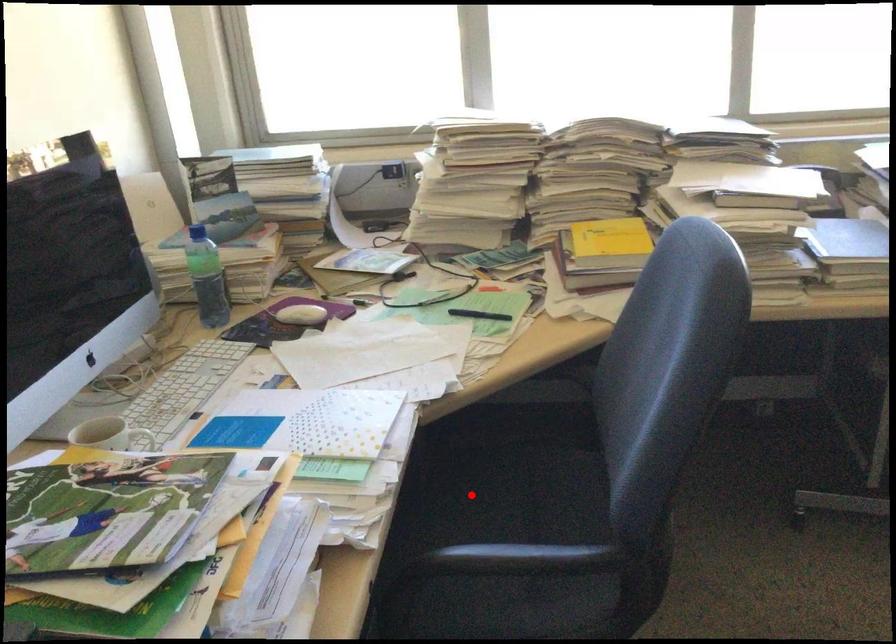
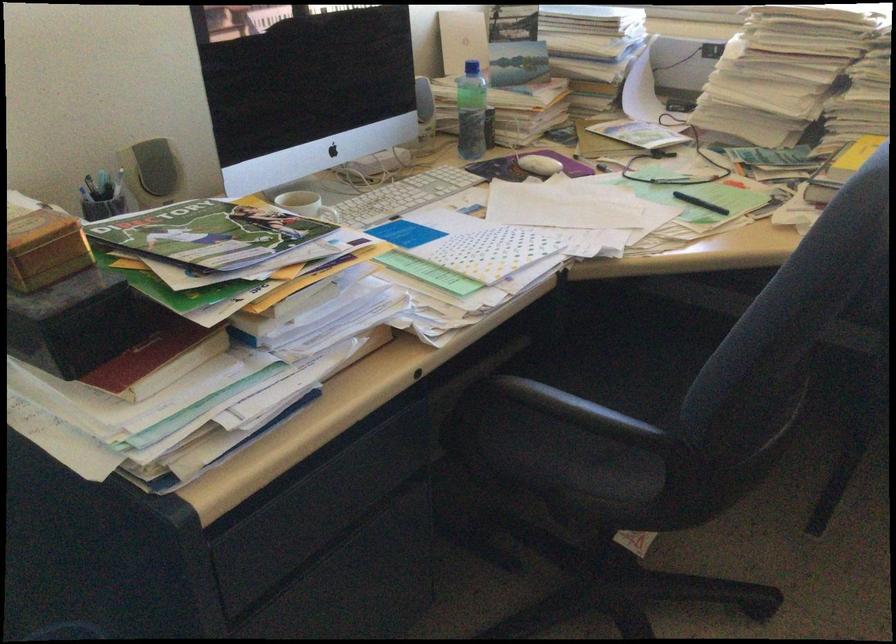
Find the pixel in the second image that matches the highlighted location in the first image.

(618, 365)